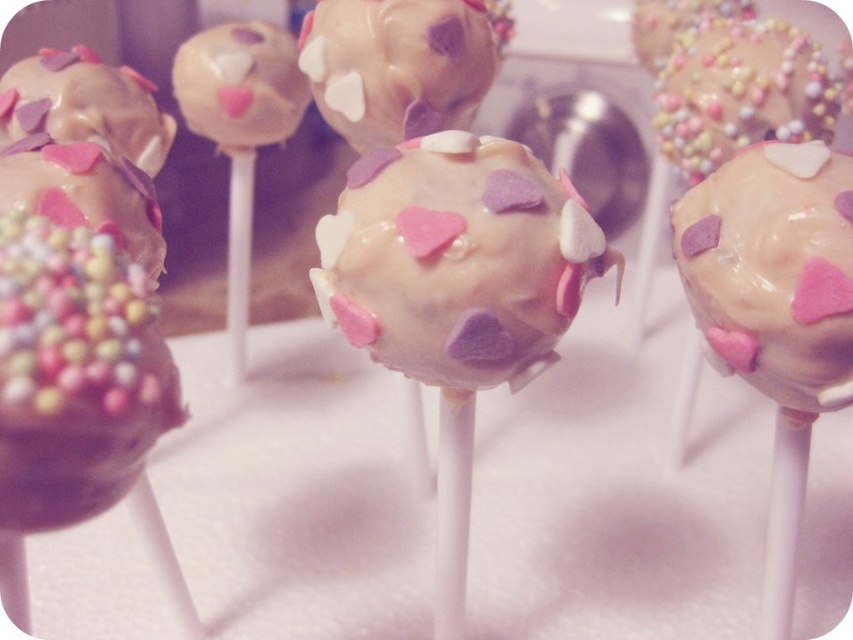
Based on the photo, you are a customer at a bakery and want to choose a cake pop that is closer to you. You see the white glossy cake pop at center and the matte white cake pop at right. Which one should you pick?

The white glossy cake pop at center is closer to you than the matte white cake pop at right, so you should pick the white glossy cake pop at center.

Consider the image. You are a customer at a bakery and see two cake pops on display. The first is the white glossy cake pop at center, and the second is the matte white cake pop at right. If you want to pick up the one that is higher up, which one should you choose?

The white glossy cake pop at center is higher up because it is positioned above the matte white cake pop at right.